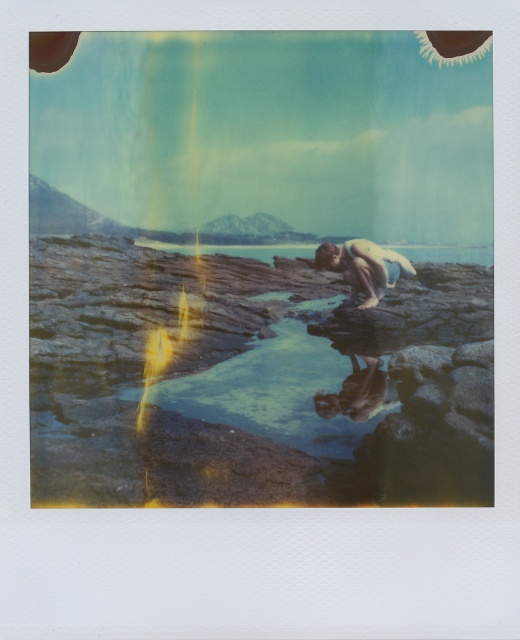
In the vintage Polaroid photo of the rocky coastal scene, there is a smooth skin person at center and smooth stone water at center. Which object takes up more space in the image?

The smooth skin person at center is bigger than smooth stone water at center, so the smooth skin person at center takes up more space in the image.

You are a photographer trying to capture the child in the scene. The child is at point (362, 266). You need to ensure the child is centered in your shot. Is the child already centered in the image?

The child is already centered in the image as the point (362, 266) corresponds to the center position.

You are a photographer trying to capture the smooth skin person at center in the best possible way. Where should you position your camera to ensure the person is centered in the frame?

To center the smooth skin person at center in the frame, position the camera so that the person is at the coordinates 0.417 on the horizontal axis and 0.698 on the vertical axis within the image plane.